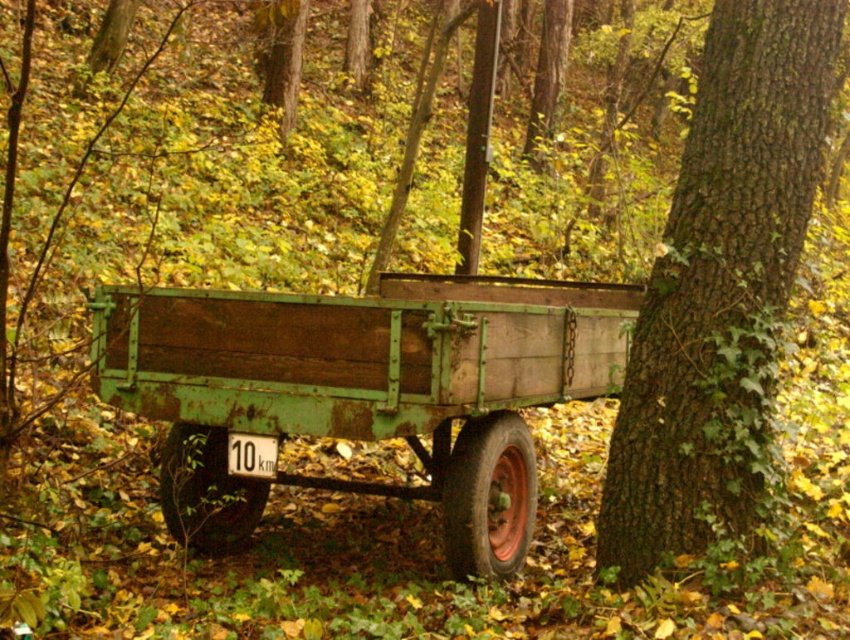
You are planning to place a small garden statue that requires a space larger than the rusty wood wagon at center. Is there enough space near the green rough bark tree at center right?

The rusty wood wagon at center is bigger than the green rough bark tree at center right. Since the statue needs a space larger than the wagon, the area near the tree may not be sufficient as the tree itself is smaller than the wagon.

You are a delivery person trying to load a package into the trailer bed. You see the rusty wood wagon at center and the white plastic sign at center. Which object has a greater width that might affect the space available for the package?

The rusty wood wagon at center has a greater width than the white plastic sign at center, so it occupies more space in the trailer bed and may affect the available area for the package.